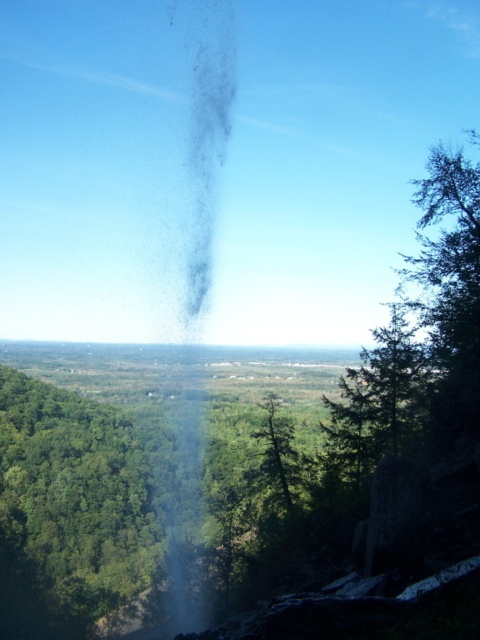
Question: Among these points, which one is farthest from the camera?

Choices:
 (A) (16, 416)
 (B) (283, 461)
 (C) (182, 444)

Answer: (C)

Question: In this image, where is green leafy tree at left located relative to green matte tree at center?

Choices:
 (A) below
 (B) above

Answer: (A)

Question: Can you confirm if smoketransparentat center is smaller than green matte tree at center?

Choices:
 (A) yes
 (B) no

Answer: (B)

Question: Among these points, which one is nearest to the camera?

Choices:
 (A) (210, 177)
 (B) (267, 460)

Answer: (B)

Question: Does green leafy tree at left come behind green matte tree at center?

Choices:
 (A) no
 (B) yes

Answer: (B)

Question: Based on their relative distances, which object is nearer to the smoketransparentat center?

Choices:
 (A) green matte tree at center
 (B) green leafy tree at left

Answer: (B)